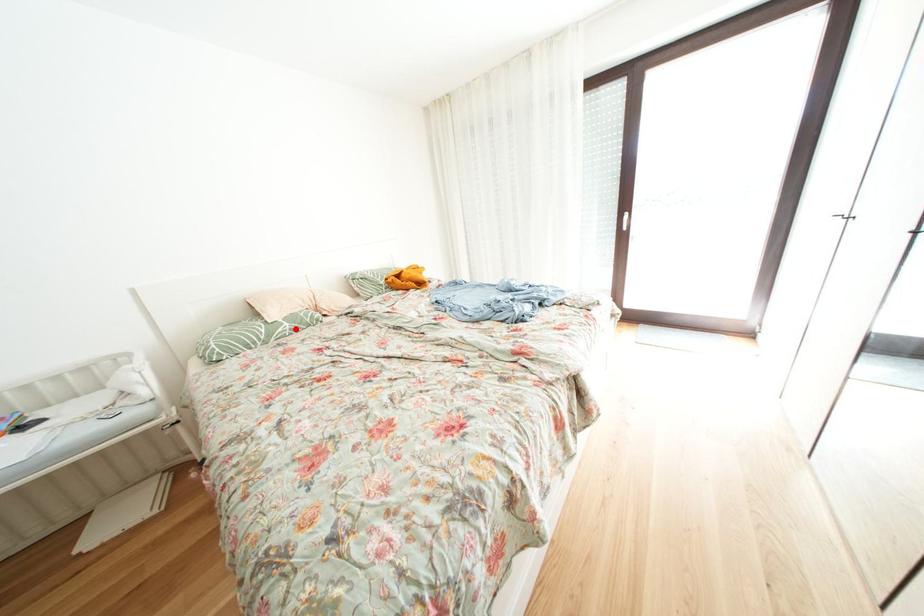
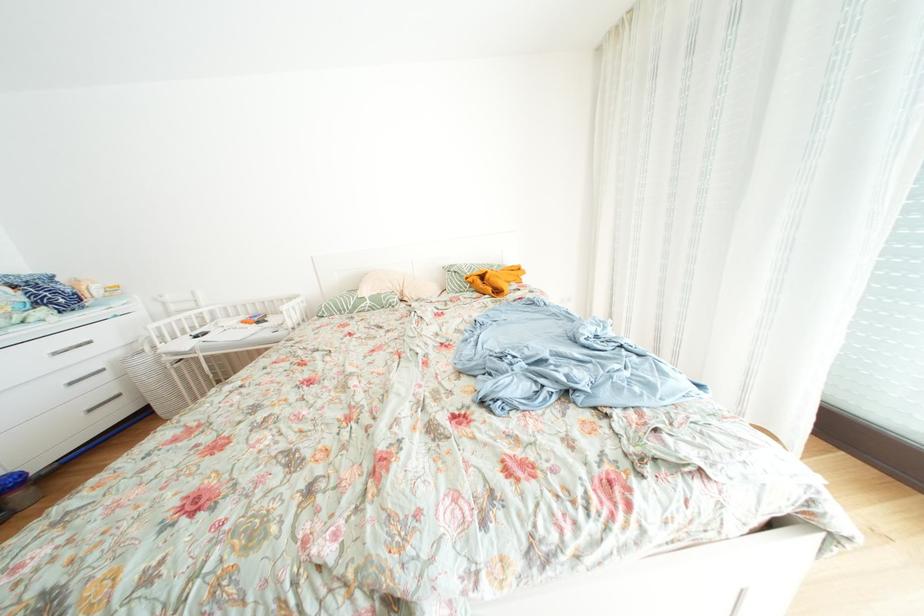
In the second image, find the point that corresponds to the highlighted location in the first image.

(378, 307)